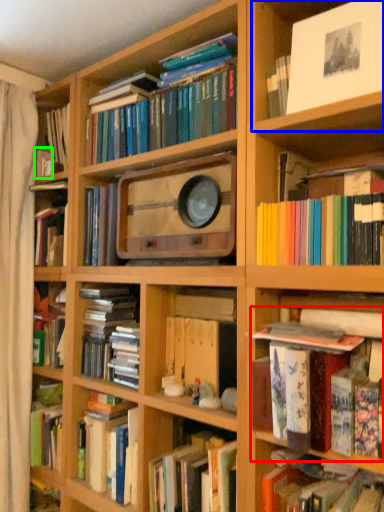
Question: Considering the real-world distances, which object is farthest from book (highlighted by a red box)? cabinet (highlighted by a blue box) or book (highlighted by a green box)?

Choices:
 (A) cabinet
 (B) book

Answer: (B)